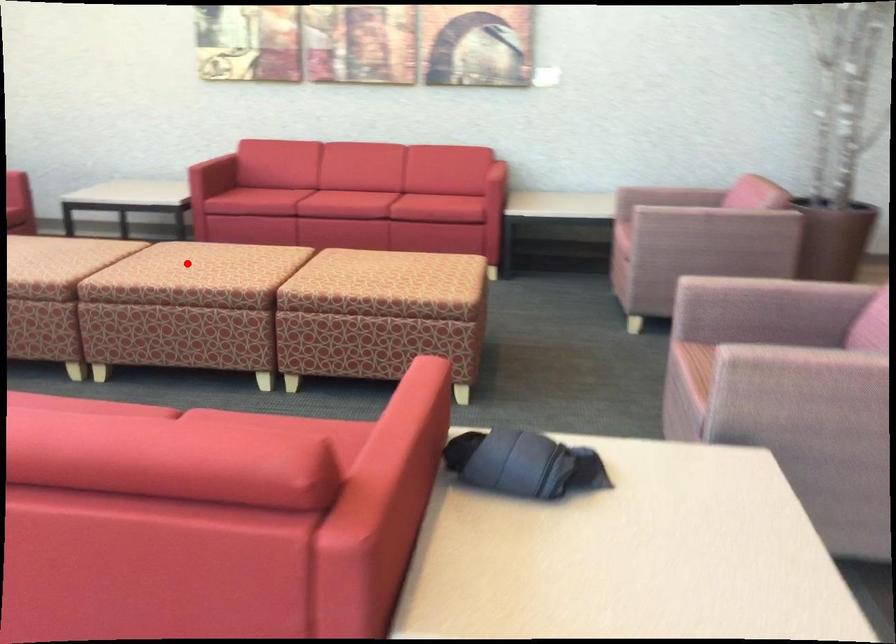
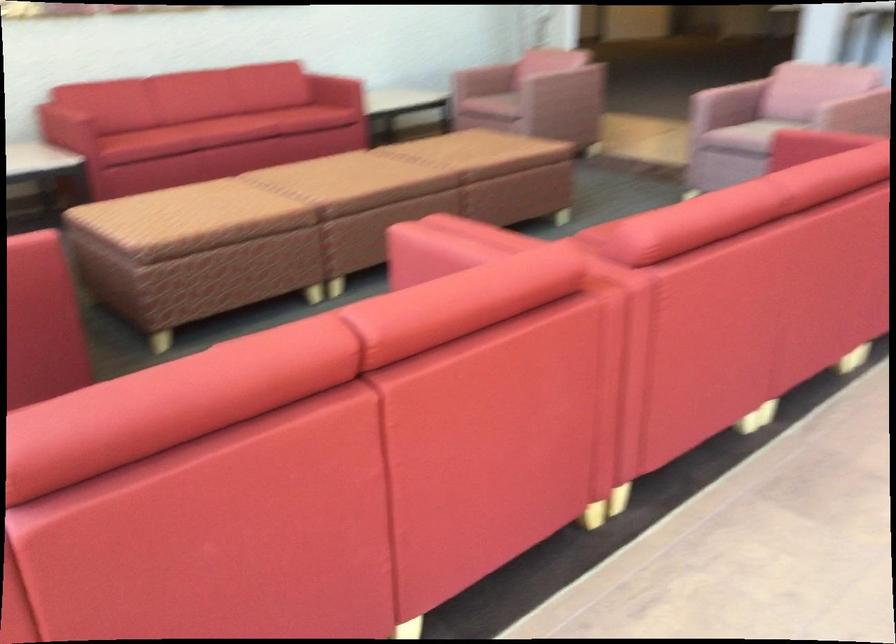
Where in the second image is the point corresponding to the highlighted location from the first image?

(349, 184)